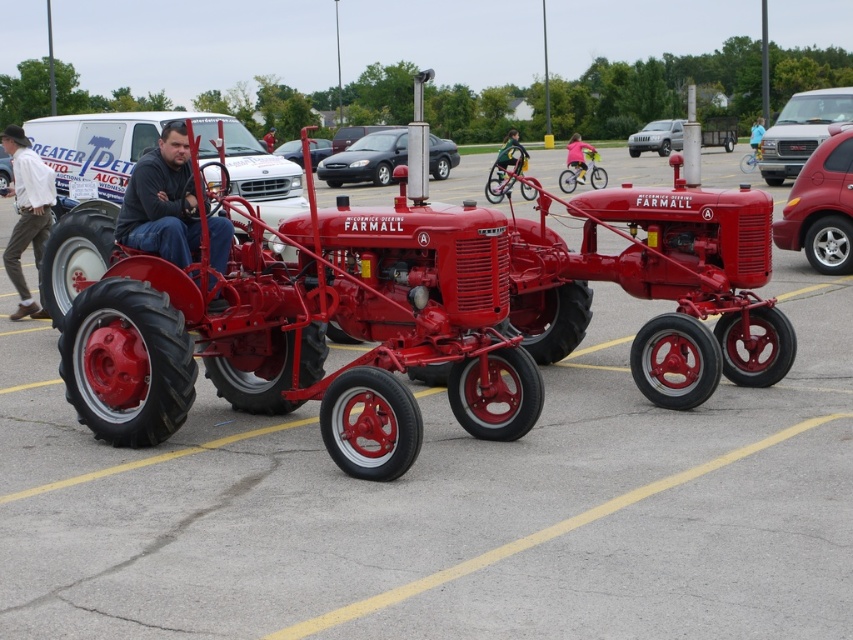
Is point (28, 300) behind point (840, 115)?

No, it is not.

Measure the distance between point (20, 304) and camera.

They are 10.81 meters apart.

Between point (53, 179) and point (822, 136), which one is positioned behind?

The point (822, 136) is more distant.

Locate an element on the screen. brushed metal pants at lower left is located at coordinates (26, 214).

Between point (83, 168) and point (190, 230), which one is positioned in front?

Point (190, 230) is more forward.

Is white glossy van at left above matte black pants at center?

Correct, white glossy van at left is located above matte black pants at center.

Does point (149, 145) come behind point (181, 221)?

Yes, it is.

Find the location of a particular element. The width and height of the screenshot is (853, 640). white glossy van at left is located at coordinates (154, 145).

Is matte black pants at center below metallic silver suv at upper right?

Yes, matte black pants at center is below metallic silver suv at upper right.

In the scene shown: Is matte black pants at center positioned before metallic silver suv at upper right?

Yes, it is.

Is point (177, 136) positioned before point (766, 161)?

Yes.

In order to click on matte black pants at center in this screenshot , I will do `click(161, 200)`.